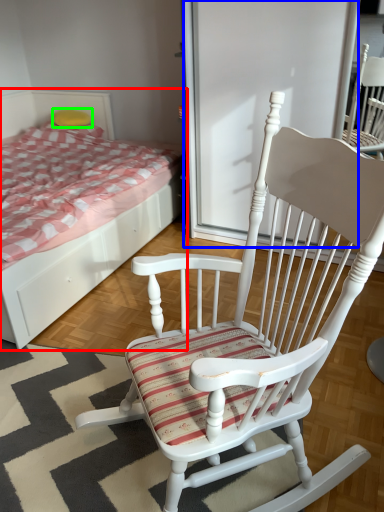
Question: Which object is positioned closest to bed (highlighted by a red box)? Select from screen door (highlighted by a blue box) and pillow (highlighted by a green box).

Choices:
 (A) screen door
 (B) pillow

Answer: (A)